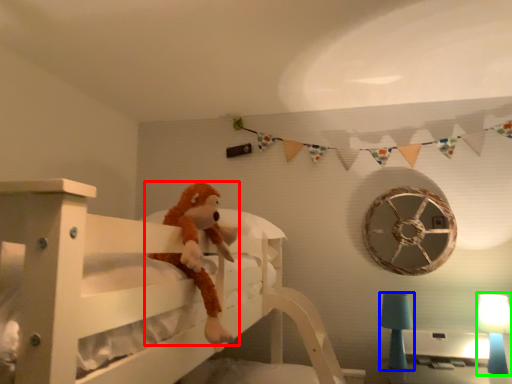
Question: Based on their relative distances, which object is nearer to toy (highlighted by a red box)? Choose from table lamp (highlighted by a blue box) and table lamp (highlighted by a green box).

Choices:
 (A) table lamp
 (B) table lamp

Answer: (A)